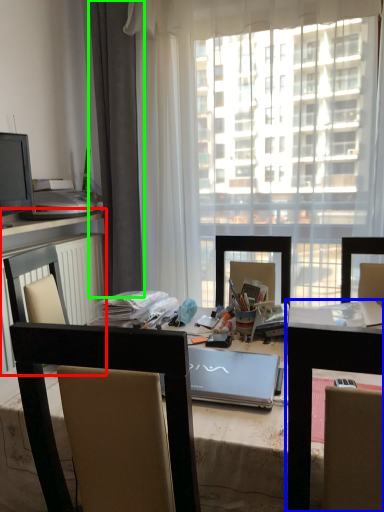
Question: Estimate the real-world distances between objects in this image. Which object is closer to computer desk (highlighted by a red box), table (highlighted by a blue box) or curtain (highlighted by a green box)?

Choices:
 (A) table
 (B) curtain

Answer: (B)